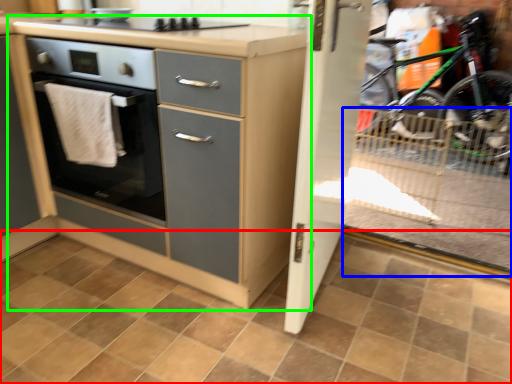
Question: Estimate the real-world distances between objects in this image. Which object is closer to ceramic tile (highlighted by a red box), glass door (highlighted by a blue box) or chest of drawers (highlighted by a green box)?

Choices:
 (A) glass door
 (B) chest of drawers

Answer: (B)